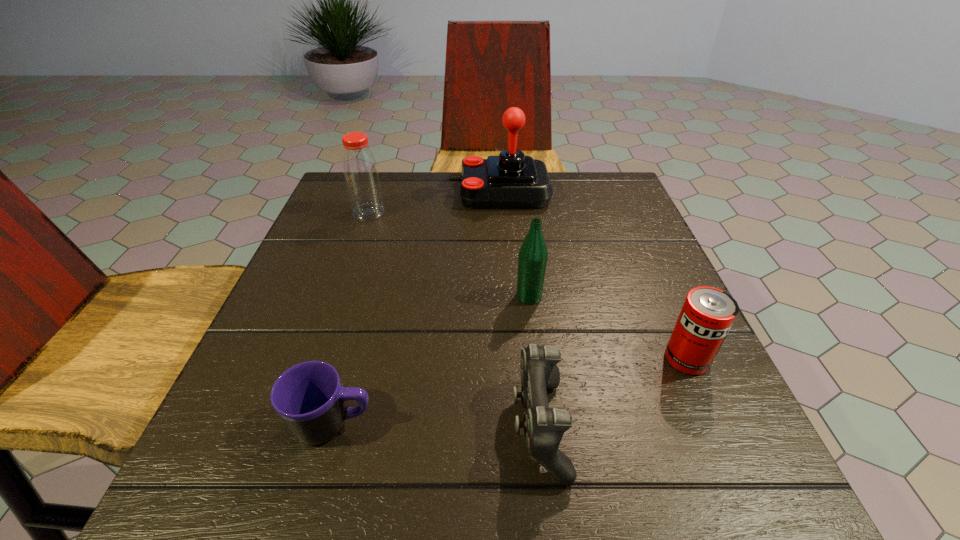
You are a GUI agent. You are given a task and a screenshot of the screen. Output one action in this format:
    pyautogui.click(x=<x>, y=<y>)
    Task: Click on the vacant space situated 0.270m on the base of the joystick
    This screenshot has height=540, width=960.
    Given the screenshot: What is the action you would take?
    pyautogui.click(x=347, y=192)

Identify the location of free space located on the right of the farther bottle. (544, 212).

I want to click on vacant space located 0.200m on the front of the nearer bottle, so click(x=541, y=396).

At what (x,y) coordinates should I click in order to perform the action: click on free space located on the back of the rightmost object. Please return your answer as a coordinate pair (x, y). Looking at the image, I should click on (637, 248).

Identify the location of vacant region located 0.180m on the surface of the control with buttons. click(390, 427).

Locate an element on the screen. This screenshot has width=960, height=540. blank area located 0.190m on the surface of the control with buttons is located at coordinates (382, 427).

At what (x,y) coordinates should I click in order to perform the action: click on free space located on the surface of the control with buttons. Please return your answer as a coordinate pair (x, y). This screenshot has height=540, width=960. Looking at the image, I should click on (348, 427).

Locate an element on the screen. vacant space situated 0.400m with the handle on the side of the mug is located at coordinates (647, 425).

Identify the location of joystick at the far edge. (511, 180).

Image resolution: width=960 pixels, height=540 pixels. I want to click on bottle situated at the far edge, so click(x=362, y=180).